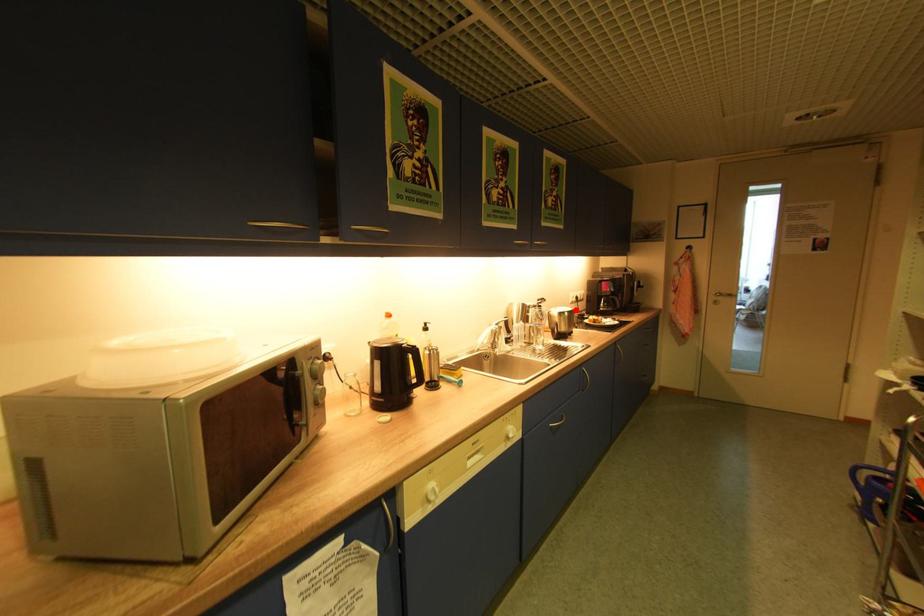
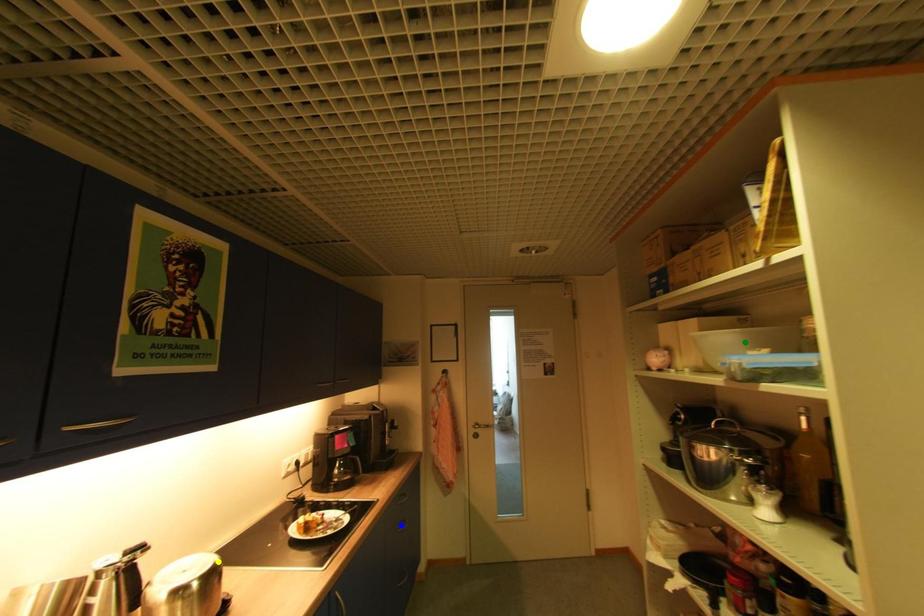
Question: I am providing you with two images of the same scene from different viewpoints. A red point is marked on the first image. You are given multiple points on the second image. Which mark in image 2 goes with the point in image 1?

Choices:
 (A) blue point
 (B) yellow point
 (C) green point

Answer: (B)